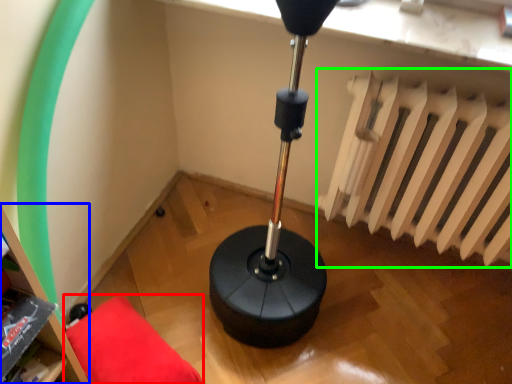
Question: Which is nearer to the furniture (highlighted by a red box)? bookshelf (highlighted by a blue box) or radiator (highlighted by a green box).

Choices:
 (A) bookshelf
 (B) radiator

Answer: (A)